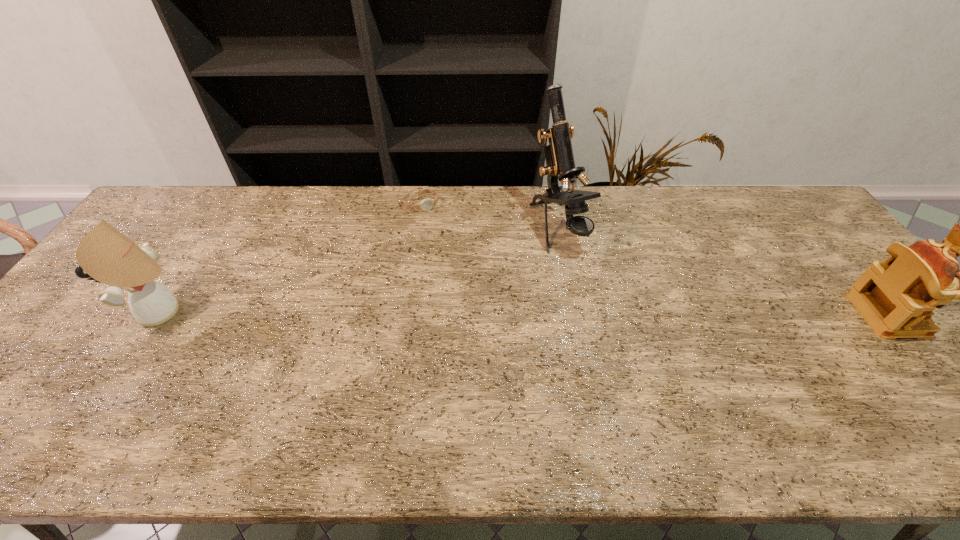
The width and height of the screenshot is (960, 540). I want to click on free space at the left edge of the desktop, so click(x=72, y=355).

I want to click on vacant area at the right edge, so click(x=845, y=286).

Locate an element on the screen. This screenshot has width=960, height=540. vacant space at the far left corner of the desktop is located at coordinates (174, 199).

The width and height of the screenshot is (960, 540). Identify the location of vacant area between the figurine and the tallest object. (723, 273).

Locate an element on the screen. free spot between the tallest object and the rightmost object is located at coordinates (723, 273).

Where is `unoccupied position between the watch and the rightmost object`? unoccupied position between the watch and the rightmost object is located at coordinates (654, 260).

The height and width of the screenshot is (540, 960). I want to click on unoccupied area between the figurine and the leftmost object, so click(525, 313).

The width and height of the screenshot is (960, 540). I want to click on free point between the third object from left to right and the leftmost object, so click(362, 271).

Where is `vacant region between the leftmost object and the watch`? vacant region between the leftmost object and the watch is located at coordinates (293, 259).

The image size is (960, 540). Find the location of `vacant area between the third object from left to right and the doll`. vacant area between the third object from left to right and the doll is located at coordinates (362, 271).